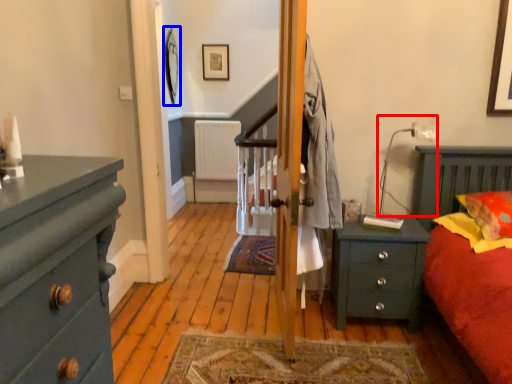
Question: Which object appears farthest to the camera in this image, lamp (highlighted by a red box) or picture frame (highlighted by a blue box)?

Choices:
 (A) lamp
 (B) picture frame

Answer: (B)